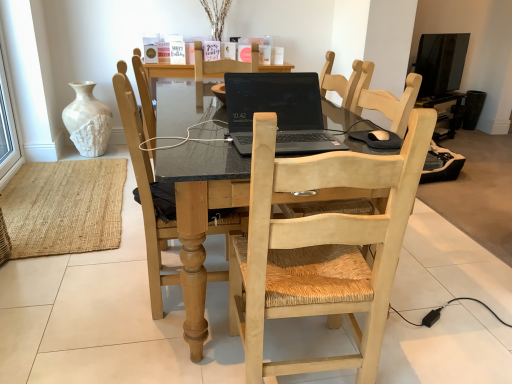
The height and width of the screenshot is (384, 512). Find the location of `free spot in front of light wood chair at center, which is the 1th chair in left-to-right order`. free spot in front of light wood chair at center, which is the 1th chair in left-to-right order is located at coordinates (153, 349).